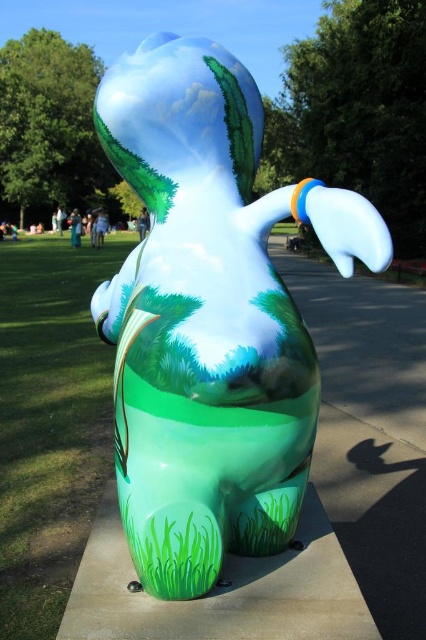
Question: Does glossy ceramic rabbit at center come behind green matte grass at lower left?

Choices:
 (A) no
 (B) yes

Answer: (A)

Question: Can you confirm if glossy ceramic rabbit at center is positioned below green matte grass at lower left?

Choices:
 (A) no
 (B) yes

Answer: (A)

Question: Which point is closer to the camera?

Choices:
 (A) (221, 372)
 (B) (58, 579)

Answer: (A)

Question: Which point appears closest to the camera in this image?

Choices:
 (A) (132, 502)
 (B) (32, 275)

Answer: (A)

Question: Which point is farther to the camera?

Choices:
 (A) green matte grass at lower left
 (B) glossy ceramic rabbit at center

Answer: (A)

Question: Is glossy ceramic rabbit at center positioned at the back of green matte grass at lower left?

Choices:
 (A) no
 (B) yes

Answer: (A)